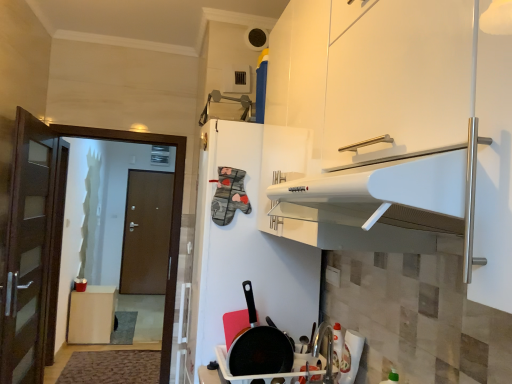
Question: Is brown wooden door at left wider than brown matte door at left?

Choices:
 (A) no
 (B) yes

Answer: (B)

Question: Considering the relative sizes of brown wooden door at left and brown matte door at left in the image provided, is brown wooden door at left thinner than brown matte door at left?

Choices:
 (A) yes
 (B) no

Answer: (B)

Question: Is brown wooden door at left outside brown matte door at left?

Choices:
 (A) no
 (B) yes

Answer: (B)

Question: Is brown wooden door at left far away from brown matte door at left?

Choices:
 (A) no
 (B) yes

Answer: (B)

Question: Is brown wooden door at left oriented away from brown matte door at left?

Choices:
 (A) no
 (B) yes

Answer: (B)

Question: From a real-world perspective, is brown wooden door at left positioned under brown matte door at left based on gravity?

Choices:
 (A) yes
 (B) no

Answer: (B)

Question: Is brown matte door at left oriented towards non-stick black frying pan at lower center?

Choices:
 (A) no
 (B) yes

Answer: (B)

Question: Would you consider brown matte door at left to be distant from non-stick black frying pan at lower center?

Choices:
 (A) yes
 (B) no

Answer: (A)

Question: Is brown matte door at left at the left side of non-stick black frying pan at lower center?

Choices:
 (A) yes
 (B) no

Answer: (A)

Question: From the image's perspective, would you say brown matte door at left is positioned over non-stick black frying pan at lower center?

Choices:
 (A) yes
 (B) no

Answer: (B)

Question: Is brown matte door at left at the right side of non-stick black frying pan at lower center?

Choices:
 (A) no
 (B) yes

Answer: (A)

Question: Is non-stick black frying pan at lower center completely or partially inside brown matte door at left?

Choices:
 (A) no
 (B) yes

Answer: (A)

Question: Does brown wooden door at left have a greater height compared to brown wood trash can at left?

Choices:
 (A) yes
 (B) no

Answer: (A)